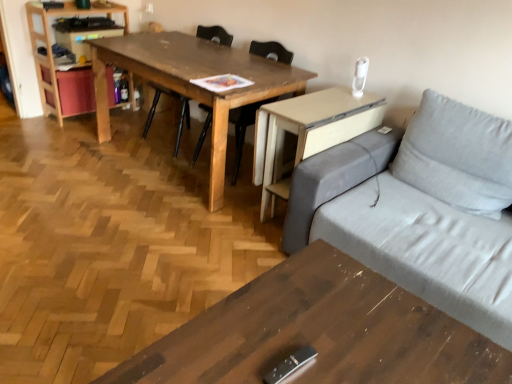
Where is `vacant space to the right of light wood bookshelf at left`? The height and width of the screenshot is (384, 512). vacant space to the right of light wood bookshelf at left is located at coordinates (130, 120).